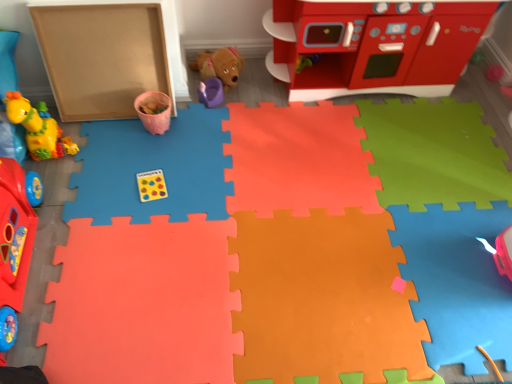
Where is `vacant space underneath rubber duck at left, the 6th toy from the left (from a real-world perspective)`? Image resolution: width=512 pixels, height=384 pixels. vacant space underneath rubber duck at left, the 6th toy from the left (from a real-world perspective) is located at coordinates (322, 219).